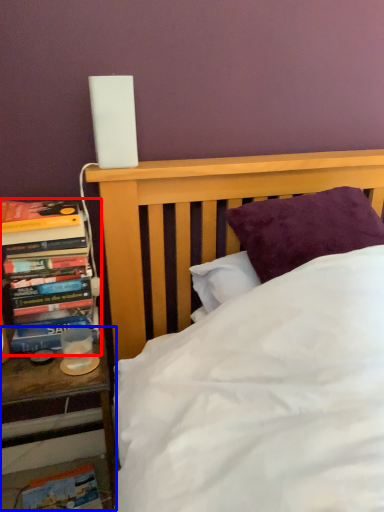
Question: Which object is closer to the camera taking this photo, book (highlighted by a red box) or nightstand (highlighted by a blue box)?

Choices:
 (A) book
 (B) nightstand

Answer: (B)